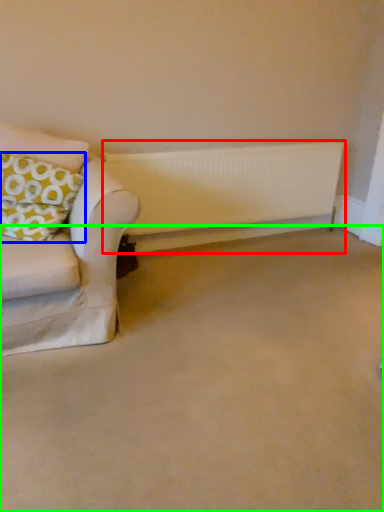
Question: Estimate the real-world distances between objects in this image. Which object is farther from radiator (highlighted by a red box), pillow (highlighted by a blue box) or plain (highlighted by a green box)?

Choices:
 (A) pillow
 (B) plain

Answer: (B)